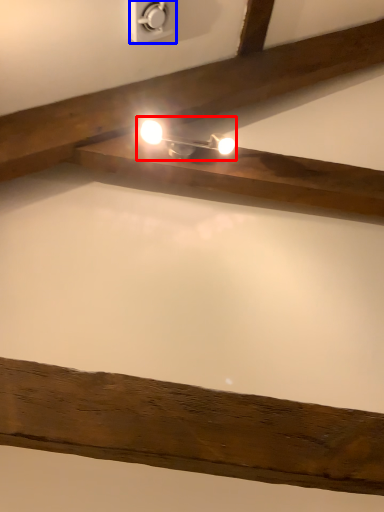
Question: Among these objects, which one is farthest to the camera, light fixture (highlighted by a red box) or power plugs and sockets (highlighted by a blue box)?

Choices:
 (A) light fixture
 (B) power plugs and sockets

Answer: (A)